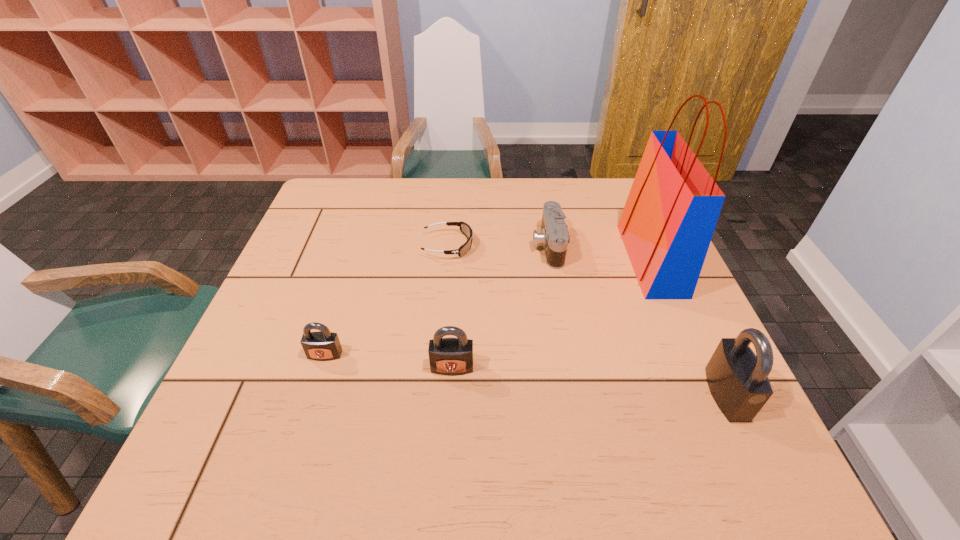
Identify the location of vacant region located on the front of the second shortest padlock near the keyhole. This screenshot has width=960, height=540. (450, 407).

Where is `free point located 0.190m on the lens of the fourth object from left to right`? This screenshot has width=960, height=540. free point located 0.190m on the lens of the fourth object from left to right is located at coordinates (464, 246).

This screenshot has height=540, width=960. Find the location of `free location located 0.170m on the lens of the fourth object from left to right`. free location located 0.170m on the lens of the fourth object from left to right is located at coordinates (471, 246).

Where is `free space located on the lens of the fourth object from left to right`? The width and height of the screenshot is (960, 540). free space located on the lens of the fourth object from left to right is located at coordinates (486, 246).

The image size is (960, 540). I want to click on free point located 0.230m on the front and sides of the shortest object, so click(x=556, y=246).

Find the location of a particular element. This screenshot has height=540, width=960. free space located on the handle side of the shopping bag is located at coordinates (489, 260).

Image resolution: width=960 pixels, height=540 pixels. Identify the location of vacant space located on the handle side of the shopping bag. (564, 260).

Where is `vacant space located 0.380m on the handle side of the shopping bag`? Image resolution: width=960 pixels, height=540 pixels. vacant space located 0.380m on the handle side of the shopping bag is located at coordinates (486, 260).

Where is `object at the near edge`? The height and width of the screenshot is (540, 960). object at the near edge is located at coordinates (738, 380).

I want to click on object present at the left edge, so click(x=323, y=345).